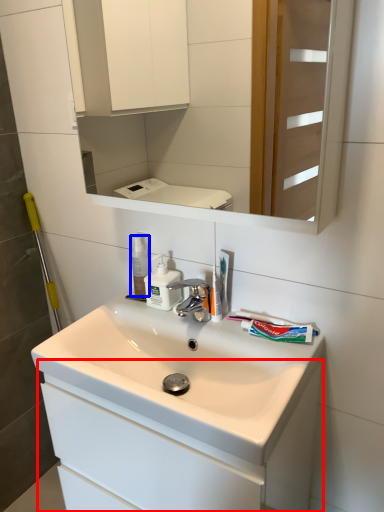
Question: Which object appears closest to the camera in this image, bathroom cabinet (highlighted by a red box) or mouthwash (highlighted by a blue box)?

Choices:
 (A) bathroom cabinet
 (B) mouthwash

Answer: (A)